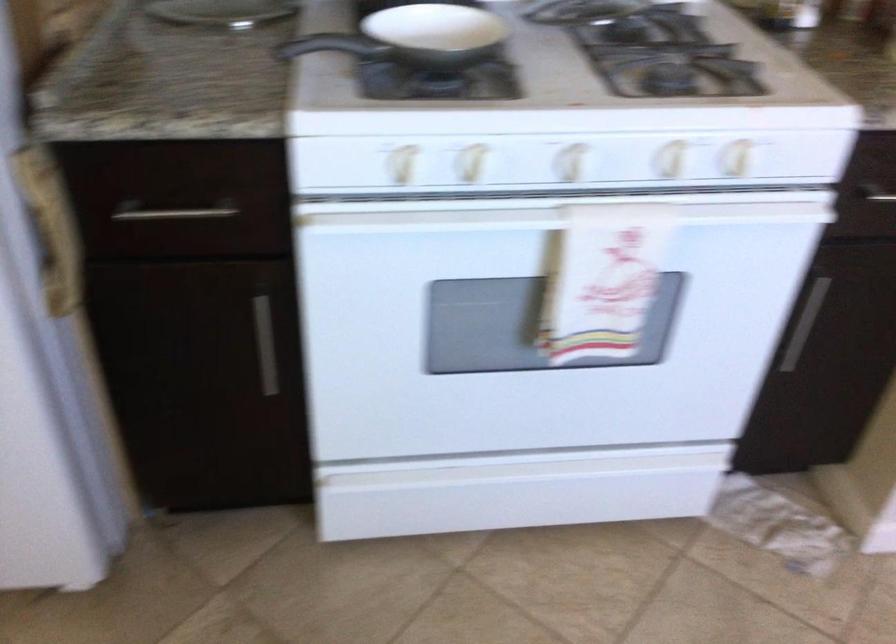
Based on the continuous images, in which direction is the camera rotating?

The camera's rotation is toward right-down.